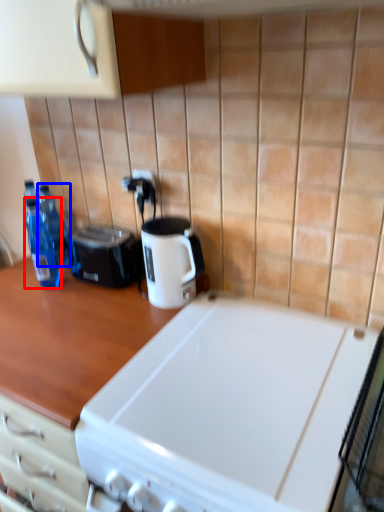
Question: Which object is further to the camera taking this photo, bottle (highlighted by a red box) or bottle (highlighted by a blue box)?

Choices:
 (A) bottle
 (B) bottle

Answer: (B)